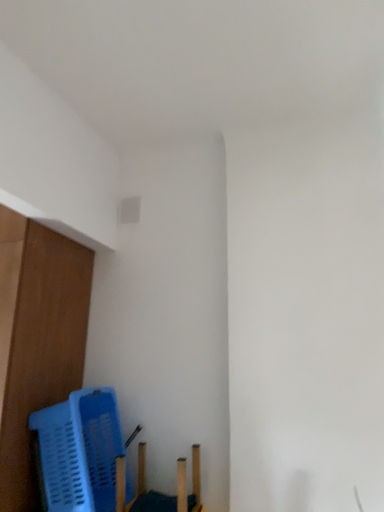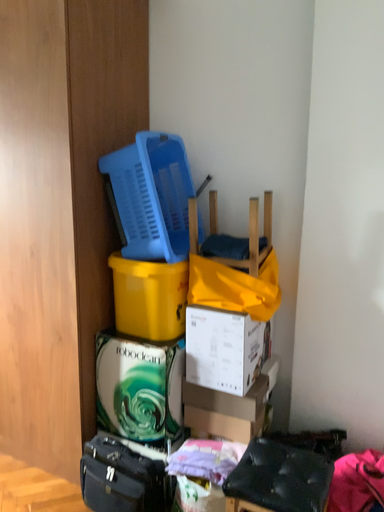
Question: Which way did the camera rotate in the video?

Choices:
 (A) rotated upward
 (B) rotated downward

Answer: (B)